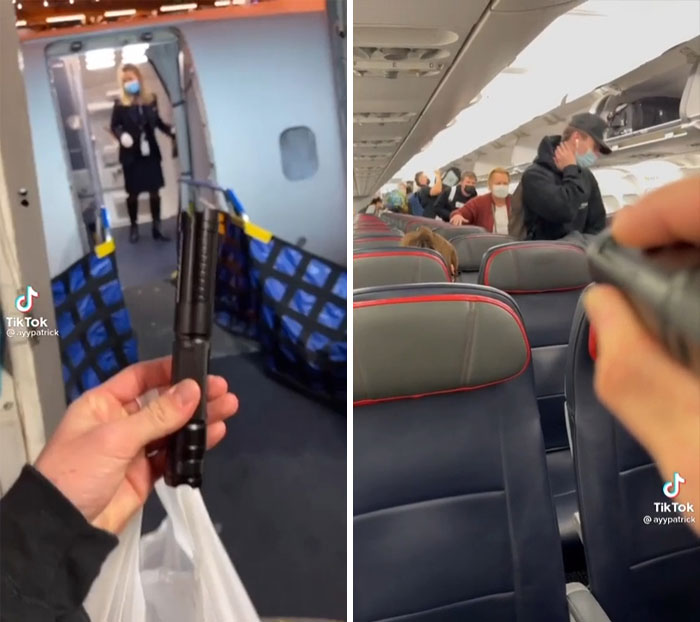
Identify the location of seats. (453, 388), (526, 323), (616, 420), (392, 265).